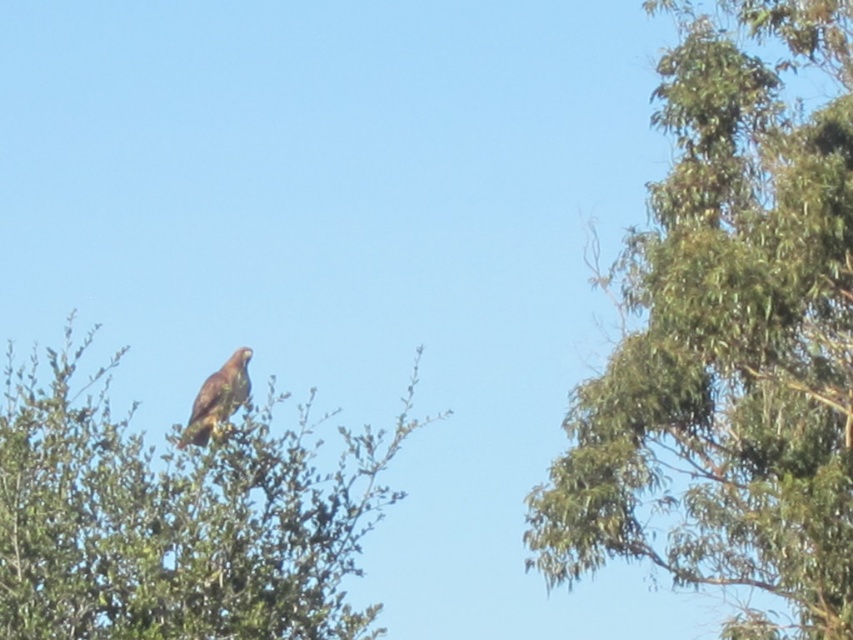
You are standing in a forest clearing and see the green leafy tree at upper left. If you want to take a photo of it from exactly 10 meters away, should you move closer or farther away?

The green leafy tree at upper left and viewer are 11.76 meters apart. To take a photo from exactly 10 meters away, you should move closer by 1.76 meters.

You are a birdwatcher trying to determine which tree has a wider spread of branches. You observe the green leafy tree at upper right and the green leafy tree at upper left. Which tree has a greater width?

The green leafy tree at upper right has a greater width than the green leafy tree at upper left.

You are planning to install a bird feeder between the green leafy tree at upper left and the green leafy tree at upper right. If the bird feeder requires a minimum of 20 feet of space between the two trees to be placed safely, will it fit?

The distance between the green leafy tree at upper left and the green leafy tree at upper right is 24.80 feet, which is more than the required 20 feet. Therefore, the bird feeder can be safely placed between them.